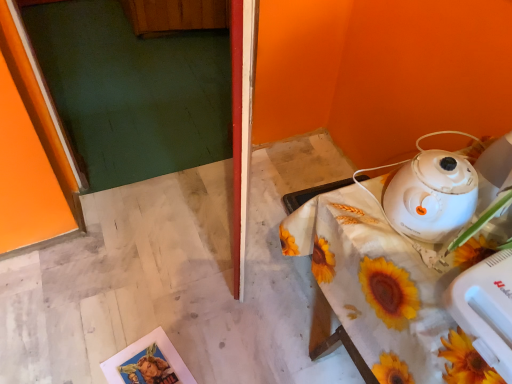
Identify the location of free space in front of white glossy kettle at upper right. The width and height of the screenshot is (512, 384). (419, 276).